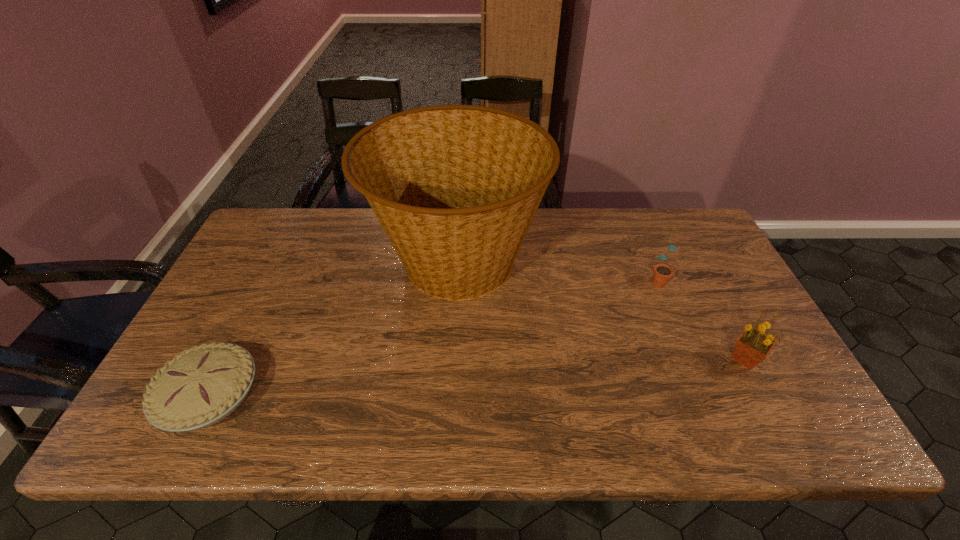
Find the location of `vacant region located at the front of the rightmost object with flowers visible`. vacant region located at the front of the rightmost object with flowers visible is located at coordinates pyautogui.click(x=653, y=359).

Locate an element on the screen. The image size is (960, 540). vacant space located 0.220m at the front of the rightmost object with flowers visible is located at coordinates (636, 359).

The width and height of the screenshot is (960, 540). Find the location of `vacant area situated at the front of the rightmost object with flowers visible`. vacant area situated at the front of the rightmost object with flowers visible is located at coordinates (636, 359).

The width and height of the screenshot is (960, 540). In order to click on free region located 0.190m on the right of the shortest object in this screenshot , I will do `click(342, 395)`.

Where is `object situated at the far edge`? object situated at the far edge is located at coordinates (455, 187).

This screenshot has width=960, height=540. I want to click on object that is at the near edge, so click(x=203, y=385).

Locate an element on the screen. object that is at the left edge is located at coordinates (203, 385).

Find the location of a particular element. This screenshot has width=960, height=540. object located at the right edge is located at coordinates (753, 346).

I want to click on object that is at the near left corner, so click(x=203, y=385).

This screenshot has height=540, width=960. In the image, there is a desktop. Find the location of `free space at the far edge`. free space at the far edge is located at coordinates (353, 211).